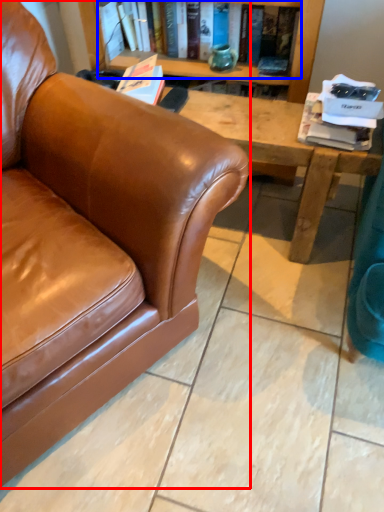
Question: Among these objects, which one is farthest to the camera, studio couch (highlighted by a red box) or book (highlighted by a blue box)?

Choices:
 (A) studio couch
 (B) book

Answer: (B)